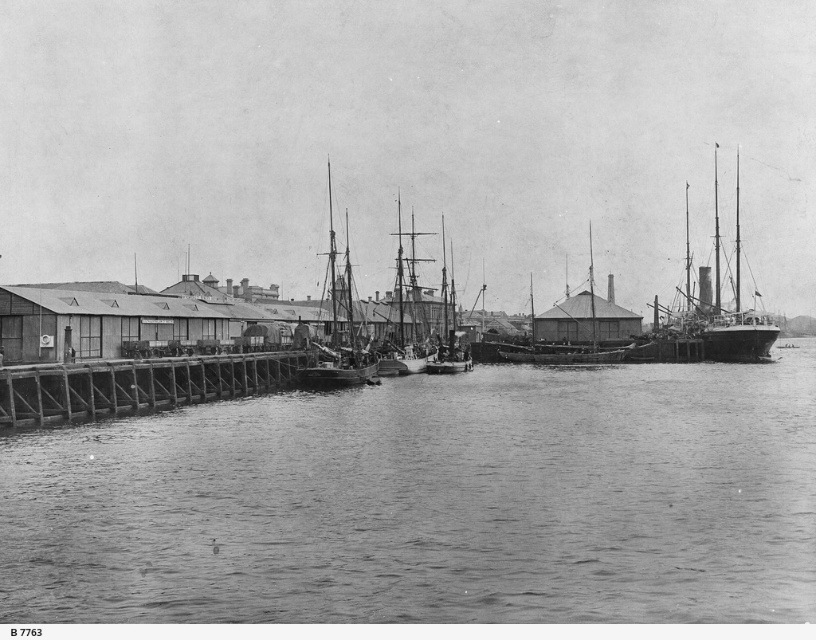
Question: Observing the image, what is the correct spatial positioning of wooden dock at lower left in reference to wooden ship at center?

Choices:
 (A) left
 (B) right

Answer: (A)

Question: Does wooden dock at lower left appear under smooth wooden ship at center?

Choices:
 (A) yes
 (B) no

Answer: (A)

Question: Estimate the real-world distances between objects in this image. Which object is closer to the smooth water at center?

Choices:
 (A) wooden dock at lower left
 (B) smooth wooden ship at center

Answer: (A)

Question: Which of the following is the farthest from the observer?

Choices:
 (A) (183, 362)
 (B) (568, 308)
 (C) (391, 332)
 (D) (446, 301)

Answer: (B)

Question: Is the position of smooth steel ship at right more distant than that of smooth wooden boat at center?

Choices:
 (A) no
 (B) yes

Answer: (B)

Question: Estimate the real-world distances between objects in this image. Which object is farther from the smooth wooden ship at center?

Choices:
 (A) rustic wooden ship at center
 (B) wooden ship at center

Answer: (B)